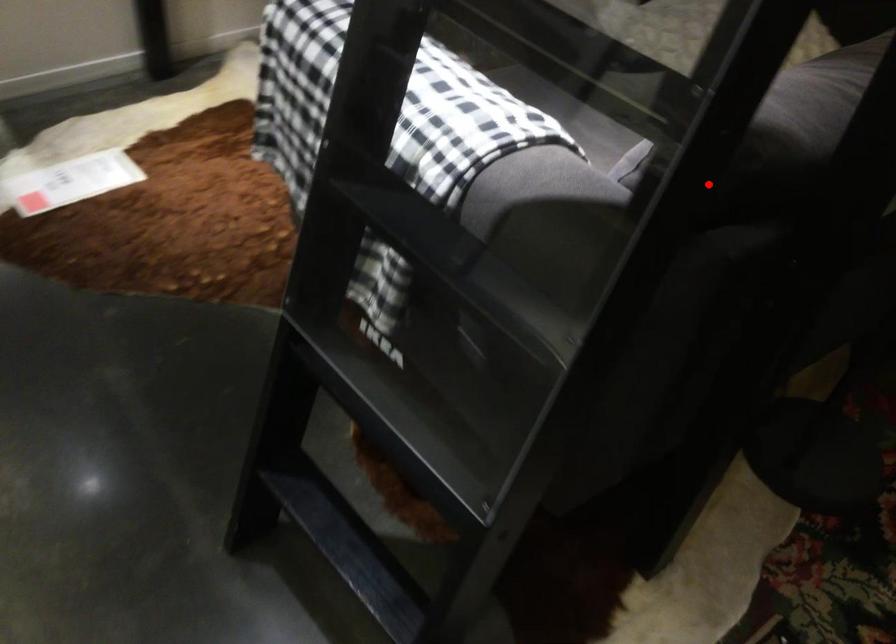
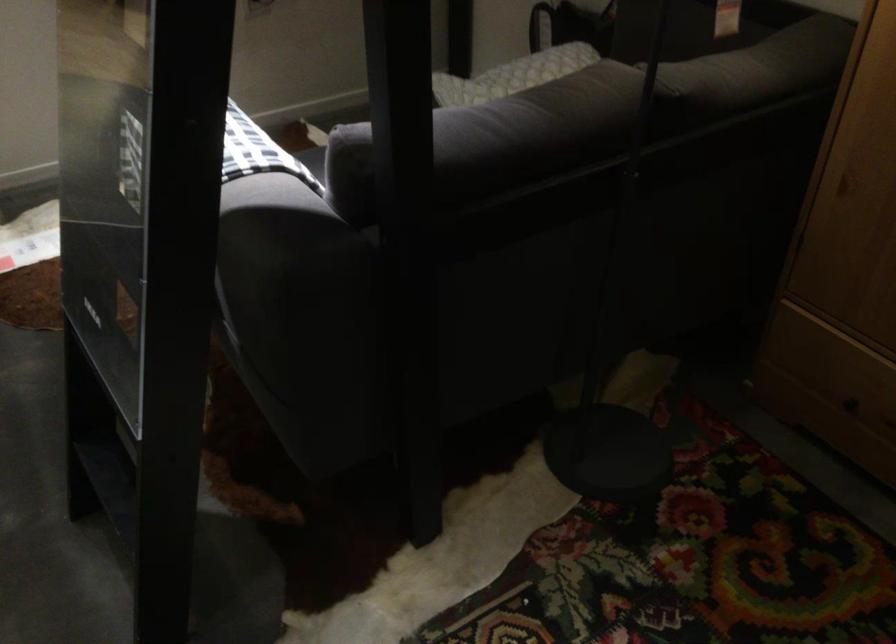
Find the pixel in the second image that matches the highlighted location in the first image.

(208, 163)